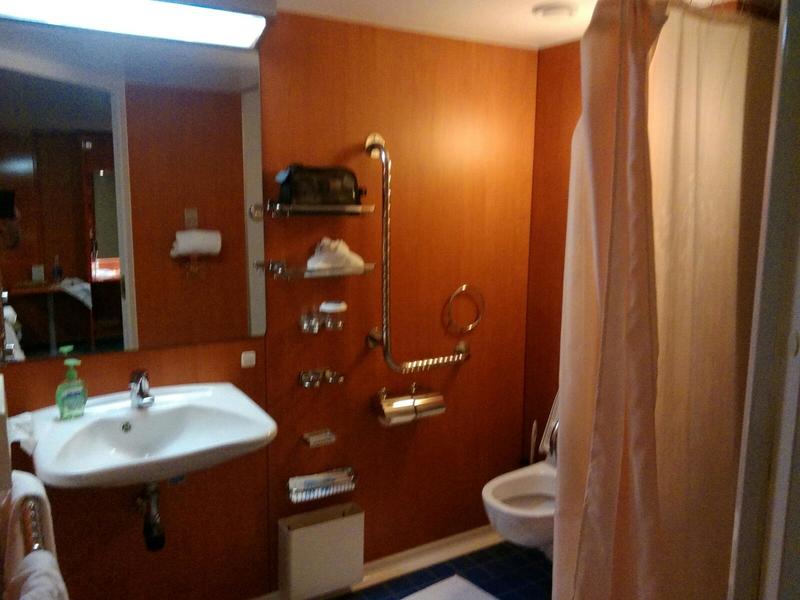
The image size is (800, 600). I want to click on chrome support handle, so click(384, 240).